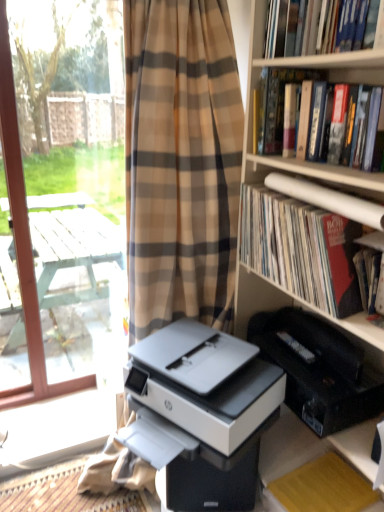
Question: Is white plastic printer at center, which is counted as the first printer, starting from the left, to the left or to the right of matte paper book at right, which is the third book in top-to-bottom order, in the image?

Choices:
 (A) right
 (B) left

Answer: (B)

Question: In terms of width, does white plastic printer at center, which is counted as the first printer, starting from the left, look wider or thinner when compared to matte paper book at right, which is the third book in top-to-bottom order?

Choices:
 (A) thin
 (B) wide

Answer: (B)

Question: Which object is positioned closest to the white wood screen door at left?

Choices:
 (A) yellow paper at lower right
 (B) hardcover book at upper right, arranged as the 3th book when ordered from the bottom
 (C) white plastic printer at center, the 1th printer from the right
 (D) hardcover book at upper right, marked as the second book in a top-to-bottom arrangement
 (E) white plastic printer at center, which is counted as the first printer, starting from the left

Answer: (E)

Question: Which object is the closest to the yellow paper at lower right?

Choices:
 (A) white plastic printer at center, which appears as the second printer when viewed from the right
 (B) hardcover book at upper right, arranged as the 3th book when ordered from the bottom
 (C) white wood screen door at left
 (D) matte paper book at right, which is the first book in bottom-to-top order
 (E) white plastic printer at center, the 1th printer from the right

Answer: (E)